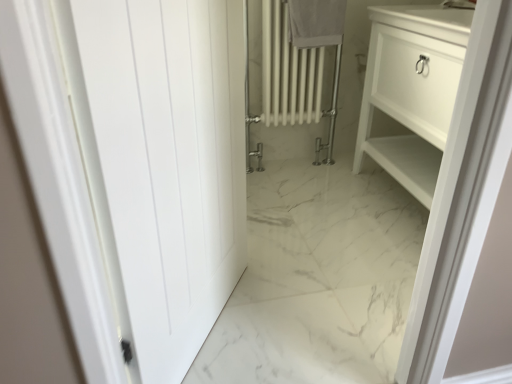
Question: Is white cotton towel at upper center turned away from white glossy cabinet at right?

Choices:
 (A) no
 (B) yes

Answer: (A)

Question: Considering the relative positions of white cotton towel at upper center and white glossy cabinet at right in the image provided, is white cotton towel at upper center to the left of white glossy cabinet at right from the viewer's perspective?

Choices:
 (A) no
 (B) yes

Answer: (B)

Question: Does white cotton towel at upper center appear on the right side of white glossy cabinet at right?

Choices:
 (A) yes
 (B) no

Answer: (B)

Question: Can you confirm if white cotton towel at upper center is shorter than white glossy cabinet at right?

Choices:
 (A) no
 (B) yes

Answer: (B)

Question: From the image's perspective, is white cotton towel at upper center on top of white glossy cabinet at right?

Choices:
 (A) no
 (B) yes

Answer: (B)

Question: Considering their positions, is white glossy cabinet at right located in front of or behind white matte door at left?

Choices:
 (A) front
 (B) behind

Answer: (B)

Question: In terms of height, does white glossy cabinet at right look taller or shorter compared to white matte door at left?

Choices:
 (A) short
 (B) tall

Answer: (A)

Question: From the image's perspective, relative to white matte door at left, is white glossy cabinet at right above or below?

Choices:
 (A) below
 (B) above

Answer: (B)

Question: Is white glossy cabinet at right inside or outside of white matte door at left?

Choices:
 (A) outside
 (B) inside

Answer: (A)

Question: Is white glossy cabinet at right to the left or to the right of white cotton towel at upper center in the image?

Choices:
 (A) right
 (B) left

Answer: (A)

Question: In terms of width, does white glossy cabinet at right look wider or thinner when compared to white cotton towel at upper center?

Choices:
 (A) wide
 (B) thin

Answer: (A)

Question: From a real-world perspective, is white glossy cabinet at right positioned above or below white cotton towel at upper center?

Choices:
 (A) below
 (B) above

Answer: (A)

Question: Is point (420, 23) positioned closer to the camera than point (332, 26)?

Choices:
 (A) farther
 (B) closer

Answer: (B)

Question: Considering the positions of white cotton towel at upper center and white matte door at left in the image, is white cotton towel at upper center taller or shorter than white matte door at left?

Choices:
 (A) short
 (B) tall

Answer: (A)

Question: Is white cotton towel at upper center inside the boundaries of white matte door at left, or outside?

Choices:
 (A) inside
 (B) outside

Answer: (B)